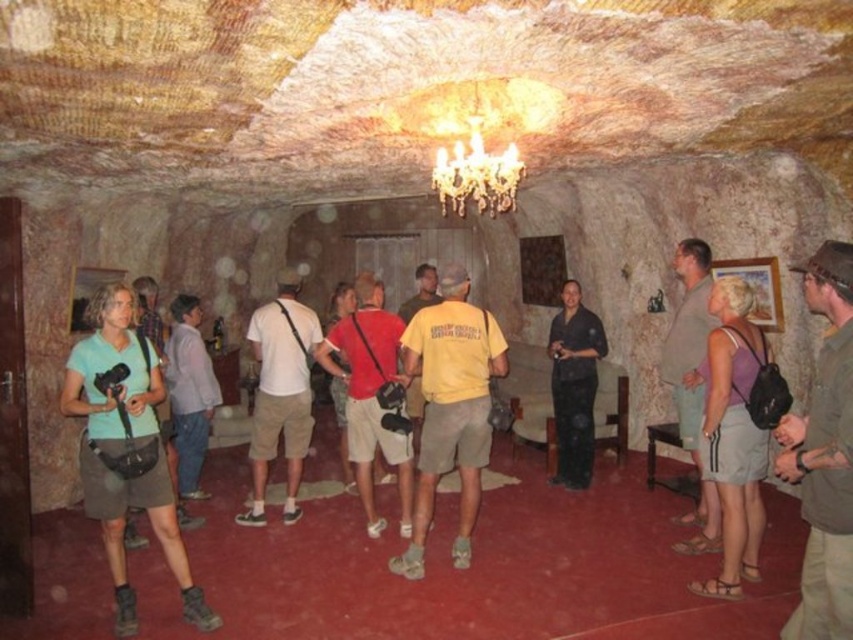
Is point (96, 419) positioned behind point (370, 332)?

That is False.

Is green fabric shirt at center in front of matte red shirt at center?

Yes, green fabric shirt at center is closer to the viewer.

Does point (119, 586) lie in front of point (405, 524)?

That is True.

I want to click on green fabric shirt at center, so click(125, 449).

Based on the photo, is brown leather hat at upper right closer to the viewer compared to matte red shirt at center?

Yes.

Is point (825, 372) positioned in front of point (368, 333)?

Yes.

Image resolution: width=853 pixels, height=640 pixels. I want to click on brown leather hat at upper right, so tap(824, 454).

Is yellow cotton shirt at center to the left of purple fabric tank top at center from the viewer's perspective?

Correct, you'll find yellow cotton shirt at center to the left of purple fabric tank top at center.

Can you confirm if yellow cotton shirt at center is shorter than purple fabric tank top at center?

No, yellow cotton shirt at center is not shorter than purple fabric tank top at center.

Which is in front, point (466, 388) or point (750, 563)?

Point (750, 563)

This screenshot has height=640, width=853. What are the coordinates of `yellow cotton shirt at center` in the screenshot? It's located at (450, 406).